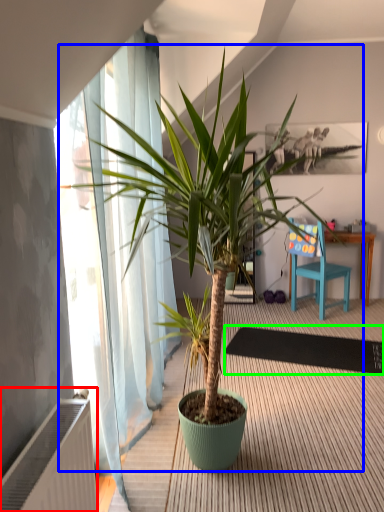
Question: Which object is positioned farthest from radiator (highlighted by a red box)? Select from houseplant (highlighted by a blue box) and mat (highlighted by a green box).

Choices:
 (A) houseplant
 (B) mat

Answer: (B)